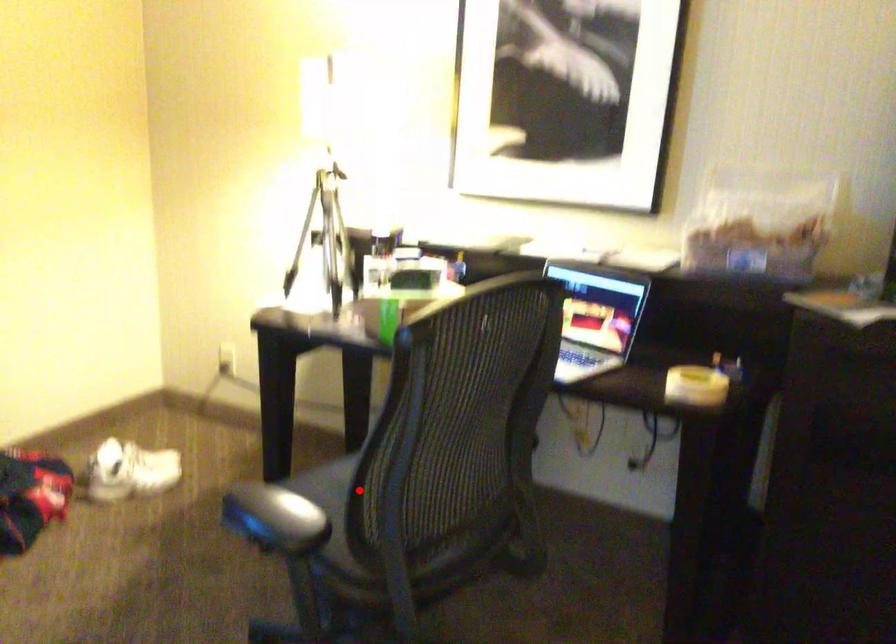
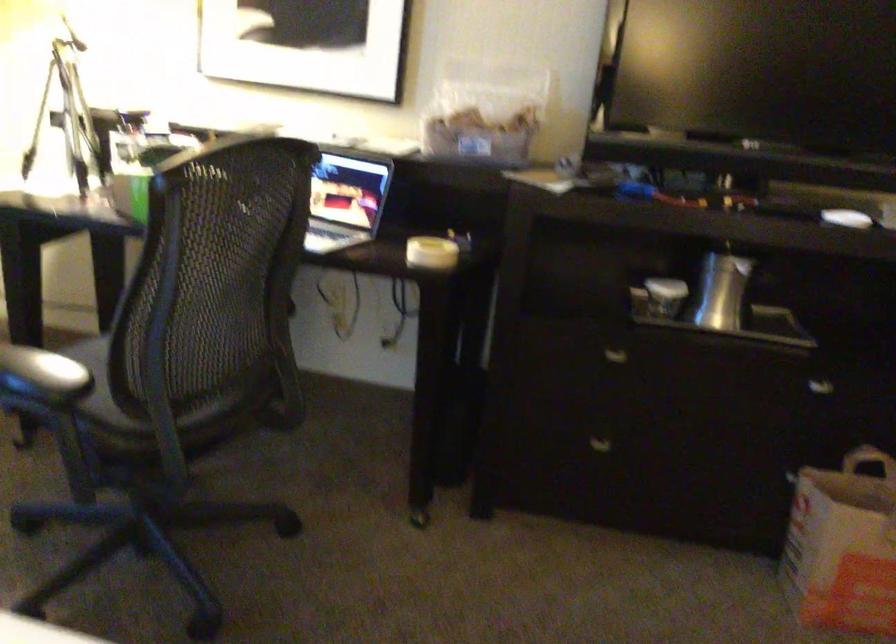
Find the pixel in the second image that matches the highlighted location in the first image.

(124, 346)